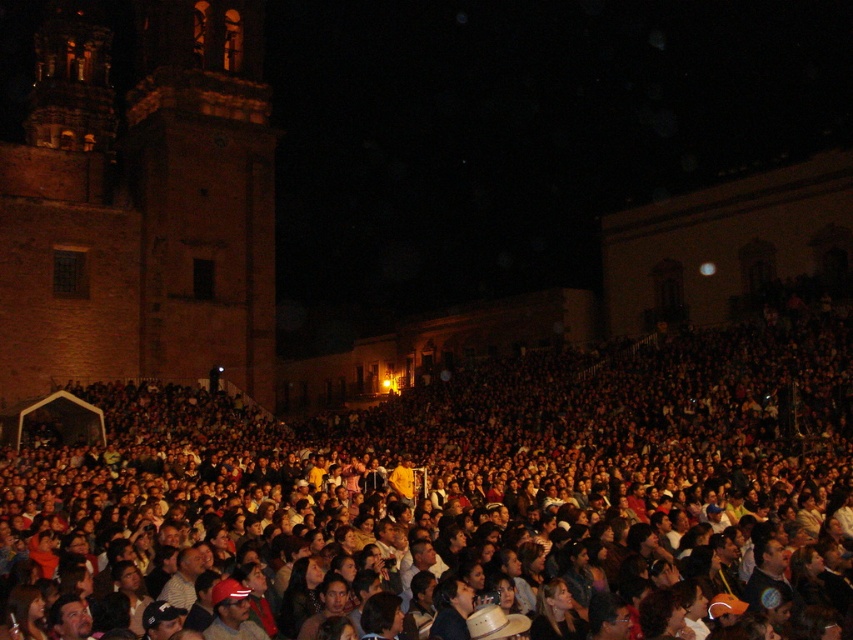
Question: Which object appears closest to the camera in this image?

Choices:
 (A) dark brown hair at center
 (B) brick church at left

Answer: (A)

Question: Which point is closer to the camera?

Choices:
 (A) brick church at left
 (B) dark brown hair at center

Answer: (B)

Question: Which object appears closest to the camera in this image?

Choices:
 (A) dark brown hair at center
 (B) brick church at left

Answer: (A)

Question: Can you confirm if dark brown hair at center is positioned to the right of brick church at left?

Choices:
 (A) no
 (B) yes

Answer: (B)

Question: Is dark brown hair at center below brick church at left?

Choices:
 (A) yes
 (B) no

Answer: (A)

Question: Is dark brown hair at center above brick church at left?

Choices:
 (A) no
 (B) yes

Answer: (A)